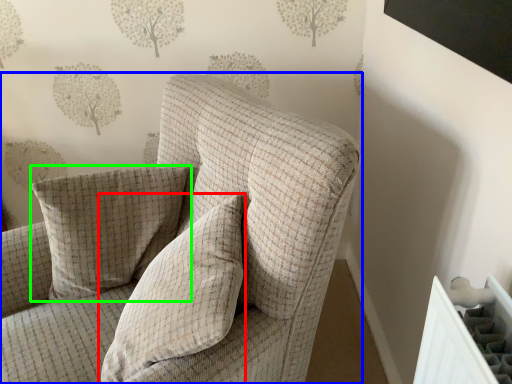
Question: Estimate the real-world distances between objects in this image. Which object is farther from pillow (highlighted by a red box), chair (highlighted by a blue box) or pillow (highlighted by a green box)?

Choices:
 (A) chair
 (B) pillow

Answer: (B)